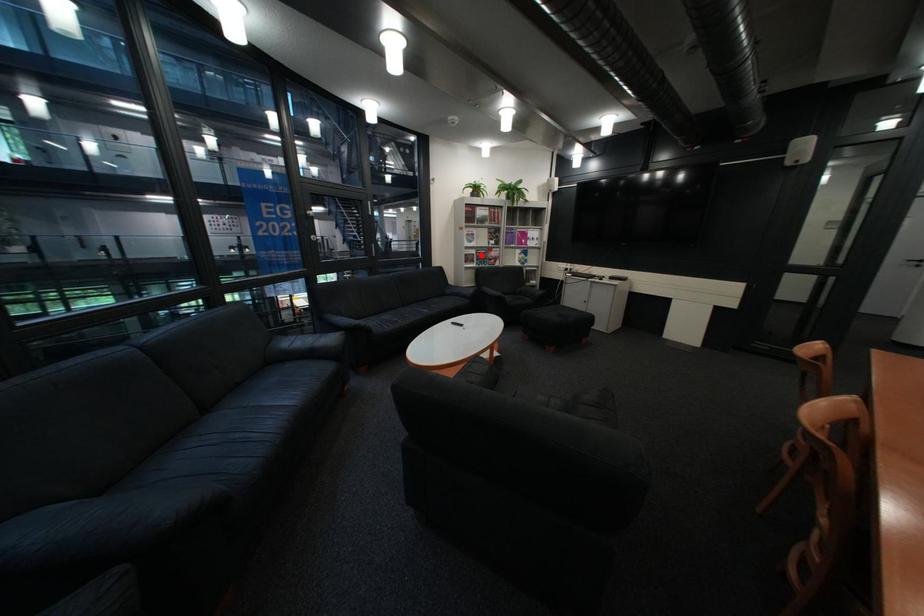
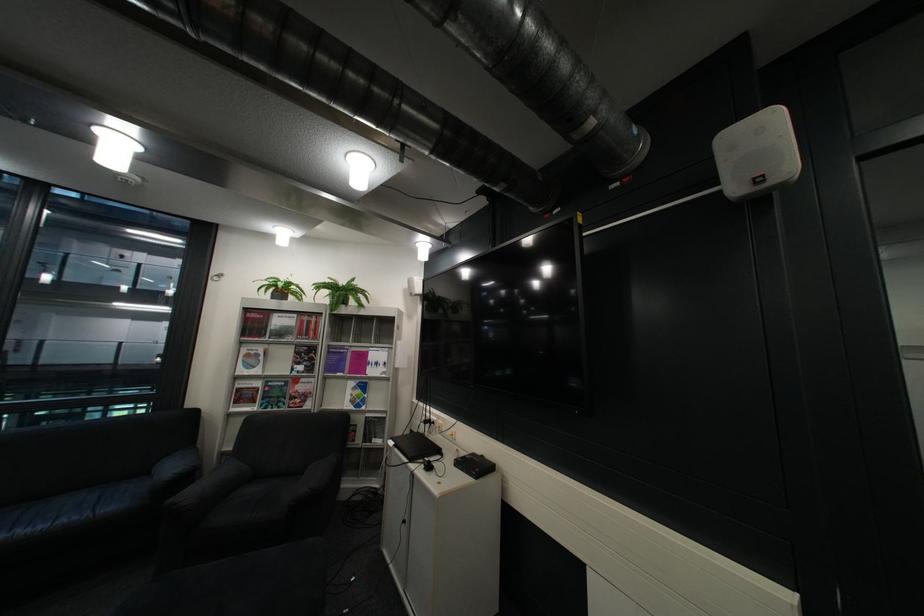
Locate, in the second image, the point that corresponds to the highlighted location in the first image.

(254, 390)